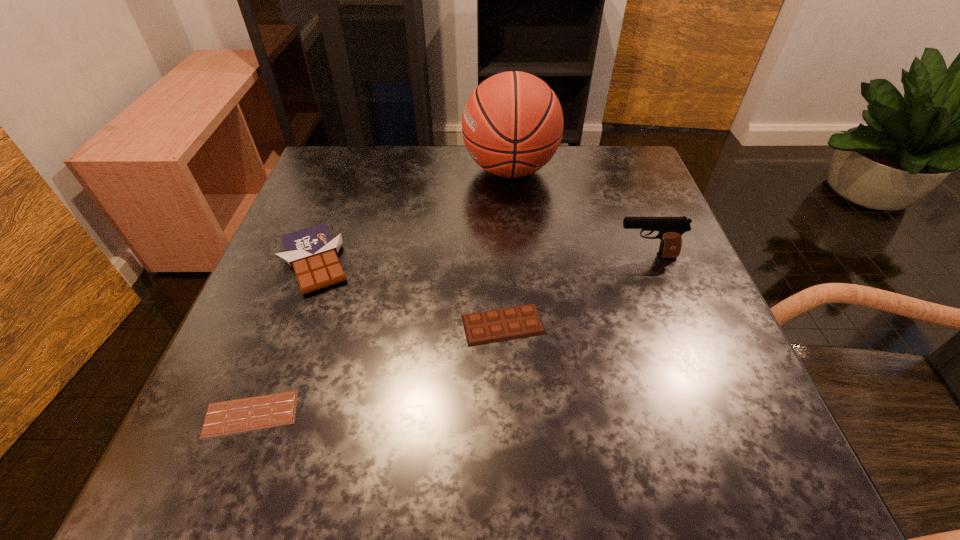
Find the location of `free location located on the logo side of the basketball`. free location located on the logo side of the basketball is located at coordinates (338, 170).

Identify the location of vacant region located 0.150m on the logo side of the basketball. (402, 170).

Image resolution: width=960 pixels, height=540 pixels. I want to click on vacant space located on the logo side of the basketball, so click(354, 170).

I want to click on free region located 0.240m at the barrel of the rightmost object, so click(x=493, y=256).

At what (x,y) coordinates should I click in order to perform the action: click on vacant space located at the barrel of the rightmost object. Please return your answer as a coordinate pair (x, y). The height and width of the screenshot is (540, 960). Looking at the image, I should click on (448, 256).

The height and width of the screenshot is (540, 960). I want to click on free space located 0.270m at the barrel of the rightmost object, so point(479,256).

Find the location of a particular element. vacant area situated 0.110m on the front of the third shortest object is located at coordinates (282, 348).

This screenshot has width=960, height=540. What are the coordinates of `vacant region located on the left of the second nearest object` in the screenshot? It's located at (426, 325).

Locate an element on the screen. This screenshot has width=960, height=540. free space located on the back of the shortest chocolate bar is located at coordinates 275,352.

Locate an element on the screen. Image resolution: width=960 pixels, height=540 pixels. object at the far edge is located at coordinates (512, 125).